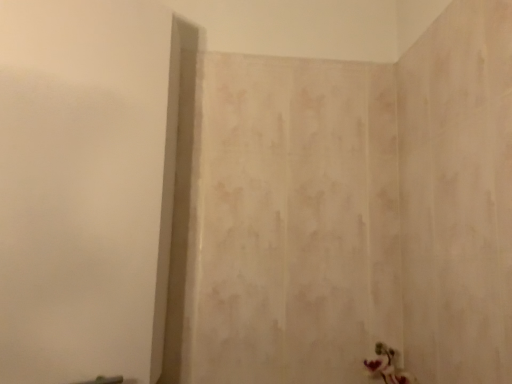
In order to face white matte screen door at left, should I rotate leftwards or rightwards?

A 24.886 degree turn to the left will do.

What do you see at coordinates (85, 187) in the screenshot? I see `white matte screen door at left` at bounding box center [85, 187].

Where is `white matte screen door at left`? Image resolution: width=512 pixels, height=384 pixels. white matte screen door at left is located at coordinates coord(85,187).

Where is `white matte screen door at left`? The height and width of the screenshot is (384, 512). white matte screen door at left is located at coordinates (85, 187).